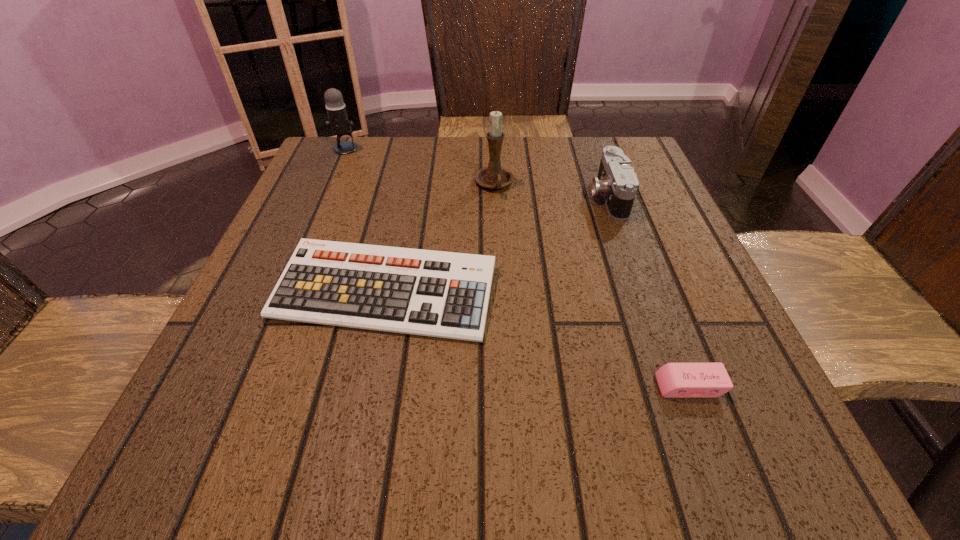
This screenshot has height=540, width=960. What are the coordinates of `object that is at the far right corner` in the screenshot? It's located at (616, 180).

The height and width of the screenshot is (540, 960). In the image, there is a desktop. In order to click on free space at the far edge in this screenshot , I will do `click(569, 150)`.

In the image, there is a desktop. Where is `vacant space at the near edge`? vacant space at the near edge is located at coordinates (603, 446).

In the image, there is a desktop. Where is `free space at the left edge`? The height and width of the screenshot is (540, 960). free space at the left edge is located at coordinates (231, 376).

The width and height of the screenshot is (960, 540). Find the location of `free space at the right edge of the desktop`. free space at the right edge of the desktop is located at coordinates (666, 355).

In the image, there is a desktop. Where is `vacant area at the far left corner`? The image size is (960, 540). vacant area at the far left corner is located at coordinates (388, 141).

You are a GUI agent. You are given a task and a screenshot of the screen. Output one action in this format:
    pyautogui.click(x=<x>, y=<y>)
    Task: Click on the vacant space at the near left corner of the desktop
    The image size is (960, 540).
    Given the screenshot: What is the action you would take?
    pyautogui.click(x=225, y=424)

Locate an element on the screen. free location at the far right corner is located at coordinates (607, 144).

Find the location of `free area in between the microphone and the nearest object`. free area in between the microphone and the nearest object is located at coordinates (517, 267).

Locate an element on the screen. The height and width of the screenshot is (540, 960). unoccupied position between the farthest object and the eraser is located at coordinates (517, 267).